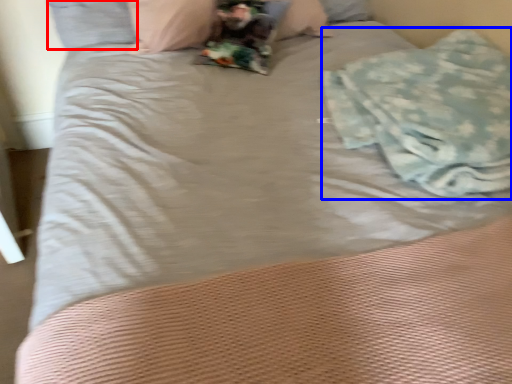
Question: Which of the following is the farthest to the observer, pillow (highlighted by a red box) or material (highlighted by a blue box)?

Choices:
 (A) pillow
 (B) material

Answer: (A)